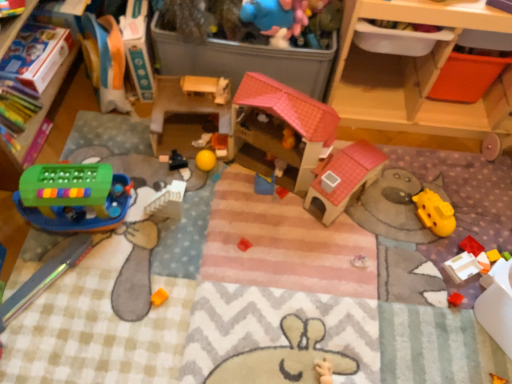
You are a GUI agent. You are given a task and a screenshot of the screen. Output one action in this format:
    pyautogui.click(x=<x>, y=<y>)
    Task: Click on the vacant area that lies between metallic blue car at center, which appears as the 8th toy when viewed from the right, and white plastic block at lower right, the 2th toy positioned from the right
    This screenshot has width=512, height=384.
    Given the screenshot: What is the action you would take?
    pyautogui.click(x=330, y=225)